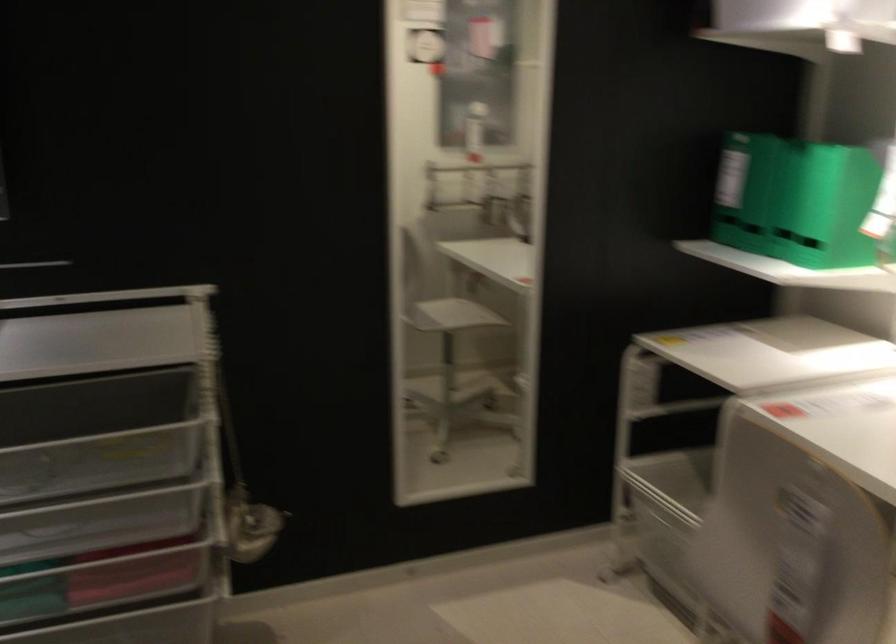
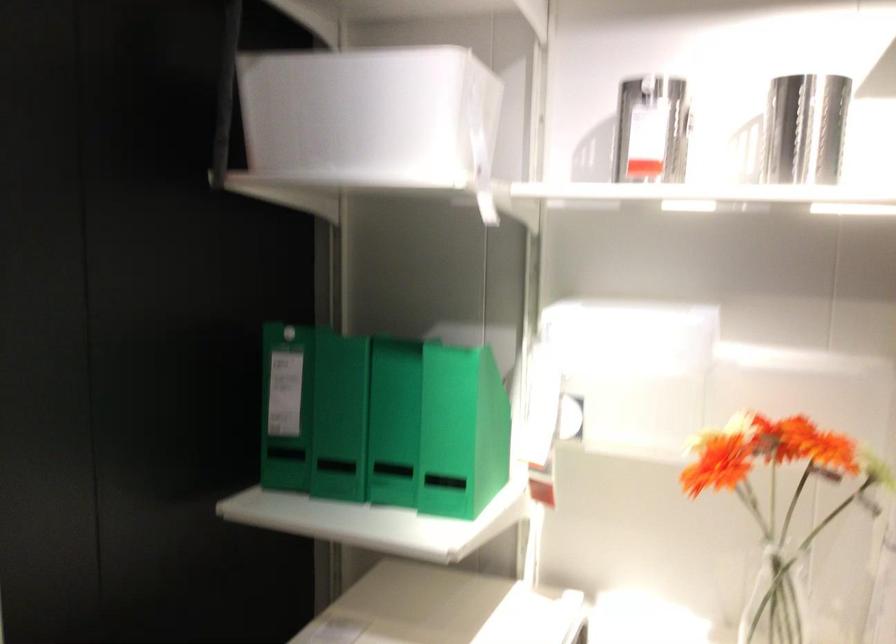
In the second image, find the point that corresponds to pixel 815 204 in the first image.

(461, 431)